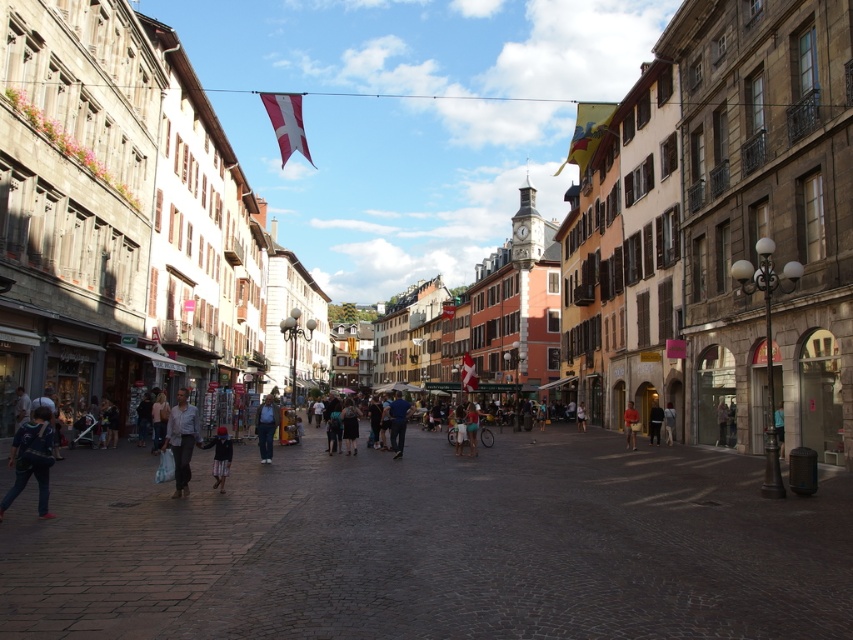
Question: Which of the following is the closest to the observer?

Choices:
 (A) light gray fabric jacket at center
 (B) denim pants at center
 (C) dark gray sweater at center

Answer: (B)

Question: Is dark gray cobblestone at center smaller than dark gray sweater at center?

Choices:
 (A) no
 (B) yes

Answer: (A)

Question: Does yellow fabric flag at upper right have a smaller size compared to dark gray sweater at center?

Choices:
 (A) yes
 (B) no

Answer: (B)

Question: Among these points, which one is farthest from the camera?

Choices:
 (A) (743, 461)
 (B) (631, 445)
 (C) (461, 387)
 (D) (270, 412)

Answer: (C)

Question: Is denim pants at center smaller than red cotton shirt at center?

Choices:
 (A) no
 (B) yes

Answer: (A)

Question: Which of the following is the closest to the observer?

Choices:
 (A) yellow fabric flag at upper right
 (B) dark gray sweater at center

Answer: (B)